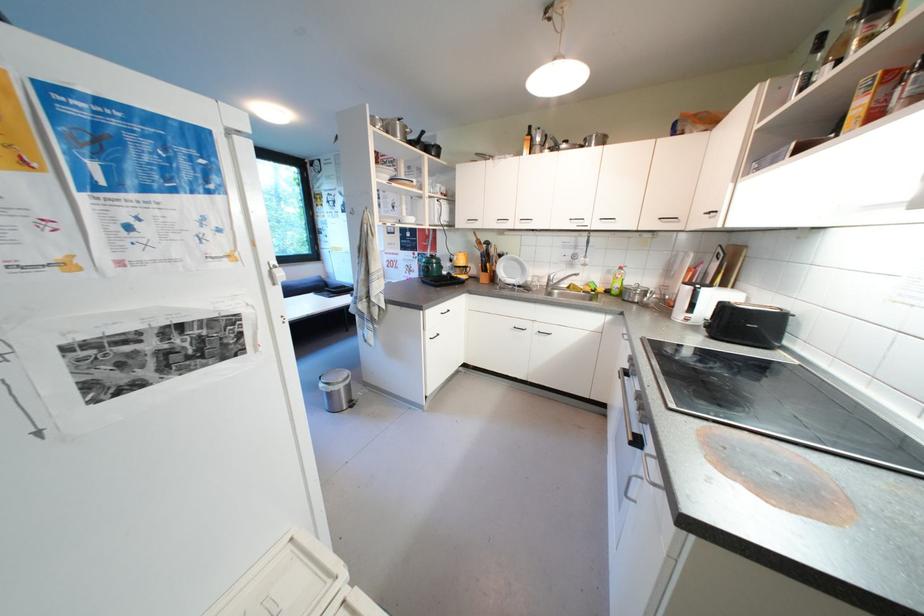
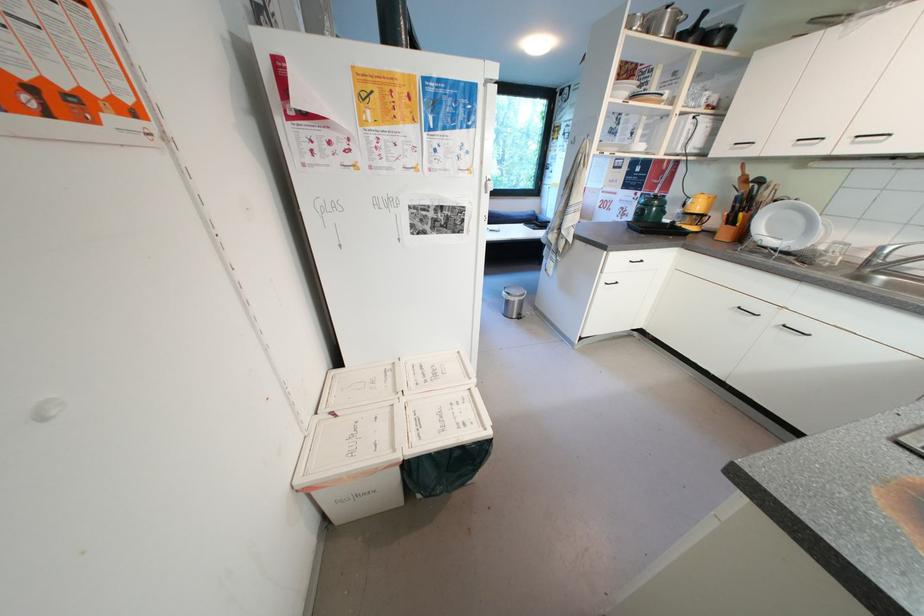
The point at [438,334] is marked in the first image. Where is the corresponding point in the second image?

(614, 280)